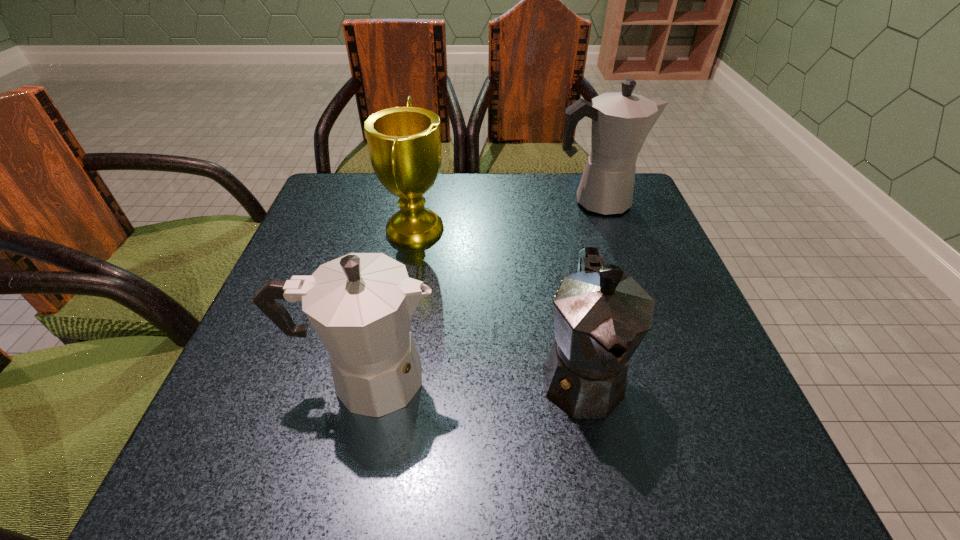
Find the location of a particular element. unoccupied position between the leftmost coffeepot and the farthest coffeepot is located at coordinates (482, 290).

Image resolution: width=960 pixels, height=540 pixels. I want to click on free space between the farthest coffeepot and the leftmost coffeepot, so click(x=482, y=290).

Find the location of `vacant space in between the farthest coffeepot and the award`. vacant space in between the farthest coffeepot and the award is located at coordinates (507, 214).

Find the location of a particular element. Image resolution: width=960 pixels, height=540 pixels. free area in between the farthest coffeepot and the leftmost coffeepot is located at coordinates [x=482, y=290].

Locate an element on the screen. This screenshot has height=540, width=960. object identified as the closest to the leftmost coffeepot is located at coordinates (601, 316).

This screenshot has width=960, height=540. In order to click on object that is the third nearest to the leftmost coffeepot in this screenshot , I will do `click(621, 121)`.

Identify which coffeepot is the second nearest to the leftmost coffeepot. Please provide its 2D coordinates. Your answer should be formatted as a tuple, i.e. [(x, y)], where the tuple contains the x and y coordinates of a point satisfying the conditions above.

[(621, 121)]

Select which coffeepot is the second closest to the farthest coffeepot. Please provide its 2D coordinates. Your answer should be formatted as a tuple, i.e. [(x, y)], where the tuple contains the x and y coordinates of a point satisfying the conditions above.

[(360, 305)]

At what (x,y) coordinates should I click in order to perform the action: click on vacant region that satisfies the following two spatial constraints: 1. on the front side of the farthest coffeepot; 2. on the shiny surface of the award. Please return your answer as a coordinate pair (x, y). Looking at the image, I should click on (608, 228).

This screenshot has width=960, height=540. I want to click on free location that satisfies the following two spatial constraints: 1. on the front side of the farthest coffeepot; 2. on the shiny surface of the award, so click(608, 228).